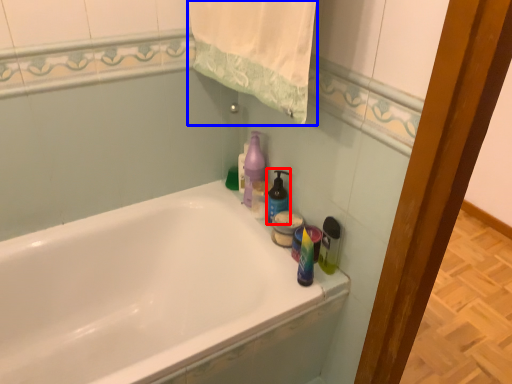
Question: Which object is closer to the camera taking this photo, cleaning product (highlighted by a red box) or bath towel (highlighted by a blue box)?

Choices:
 (A) cleaning product
 (B) bath towel

Answer: (B)